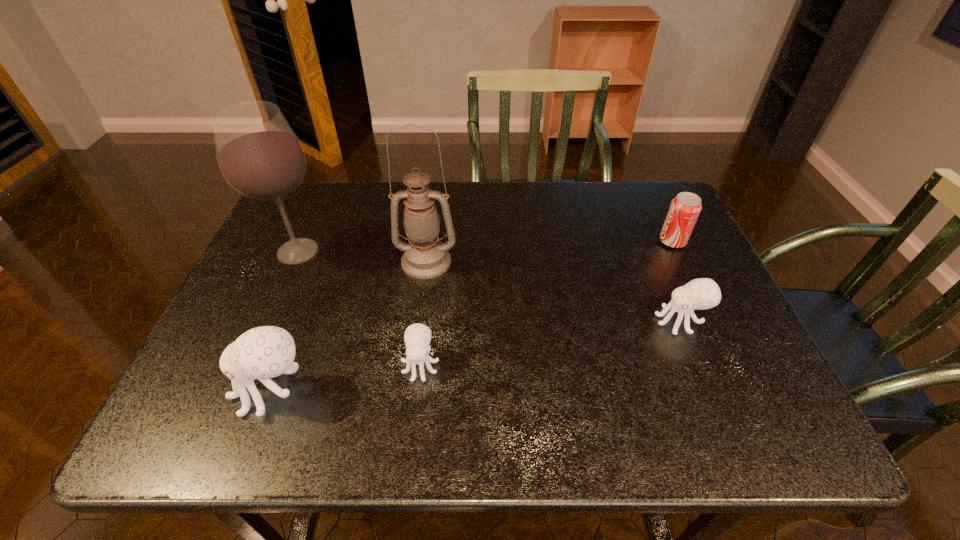
Where is `octopus located in the left edge section of the desktop`? The width and height of the screenshot is (960, 540). octopus located in the left edge section of the desktop is located at coordinates (264, 352).

The width and height of the screenshot is (960, 540). What are the coordinates of `alcohol located at the left edge` in the screenshot? It's located at (259, 155).

I want to click on octopus located in the right edge section of the desktop, so click(703, 293).

Where is `soda can that is positioned at the right edge`? The image size is (960, 540). soda can that is positioned at the right edge is located at coordinates (684, 210).

The image size is (960, 540). I want to click on object present at the near left corner, so click(264, 352).

At what (x,y) coordinates should I click in order to perform the action: click on vacant area at the far edge of the desktop. Please return your answer as a coordinate pair (x, y). Image resolution: width=960 pixels, height=540 pixels. Looking at the image, I should click on (543, 181).

At what (x,y) coordinates should I click in order to perform the action: click on vacant area at the near edge of the desktop. Please return your answer as a coordinate pair (x, y). This screenshot has height=540, width=960. Looking at the image, I should click on tap(484, 369).

I want to click on free space at the left edge of the desktop, so click(x=322, y=244).

Find the location of a particular element. This screenshot has height=540, width=960. free region at the right edge is located at coordinates (680, 261).

The width and height of the screenshot is (960, 540). In the image, there is a desktop. Identify the location of vacant region at the far left corner. (305, 221).